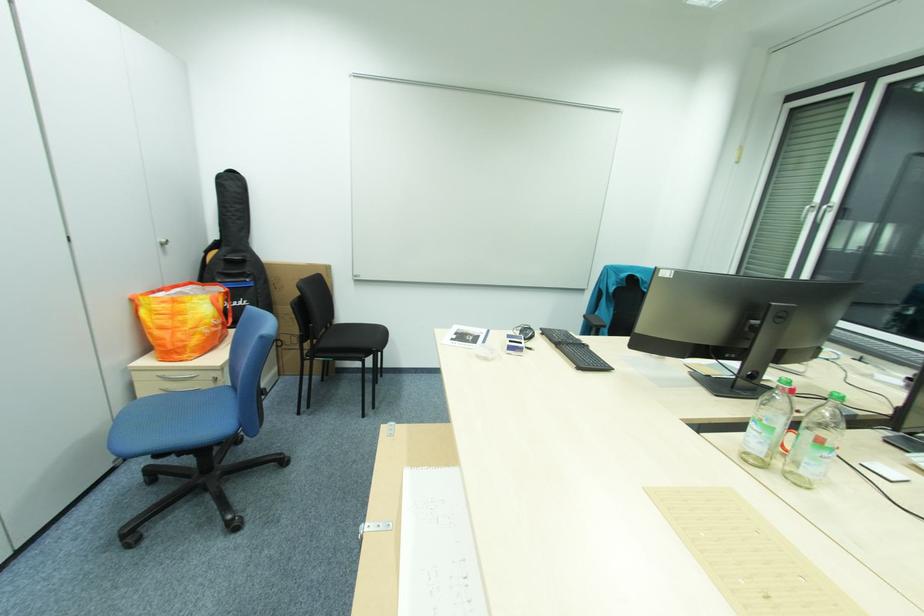
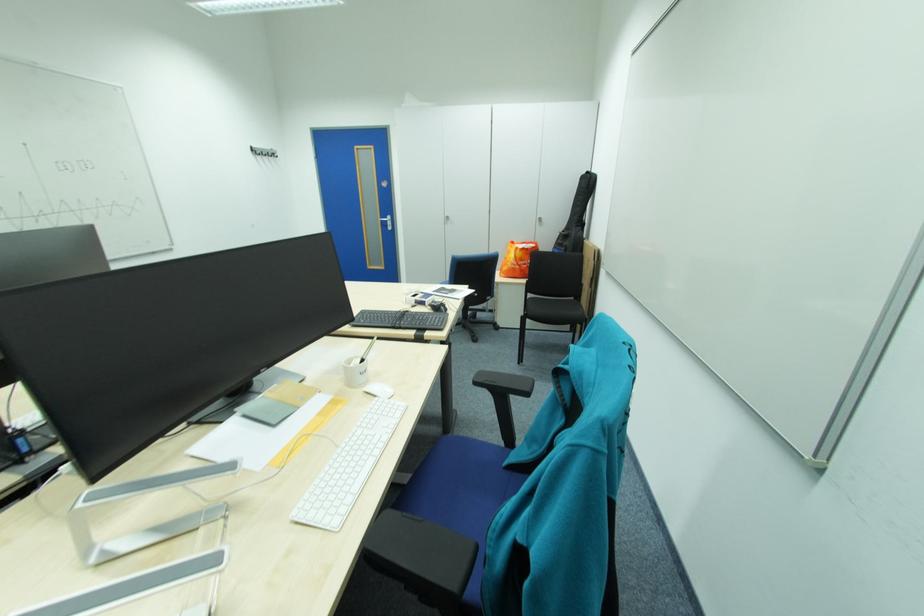
Locate, in the second image, the point that corresponds to (215,331) in the first image.

(517, 265)